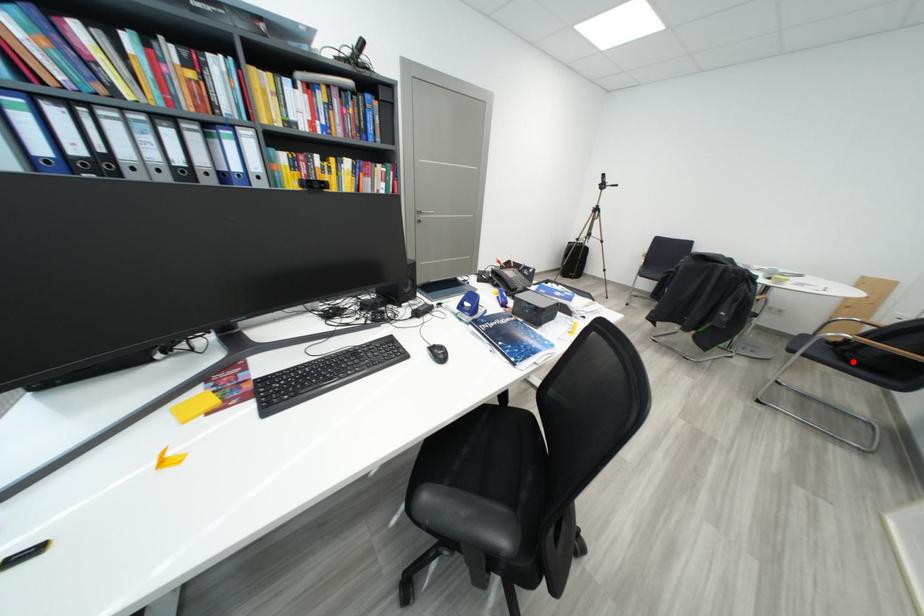
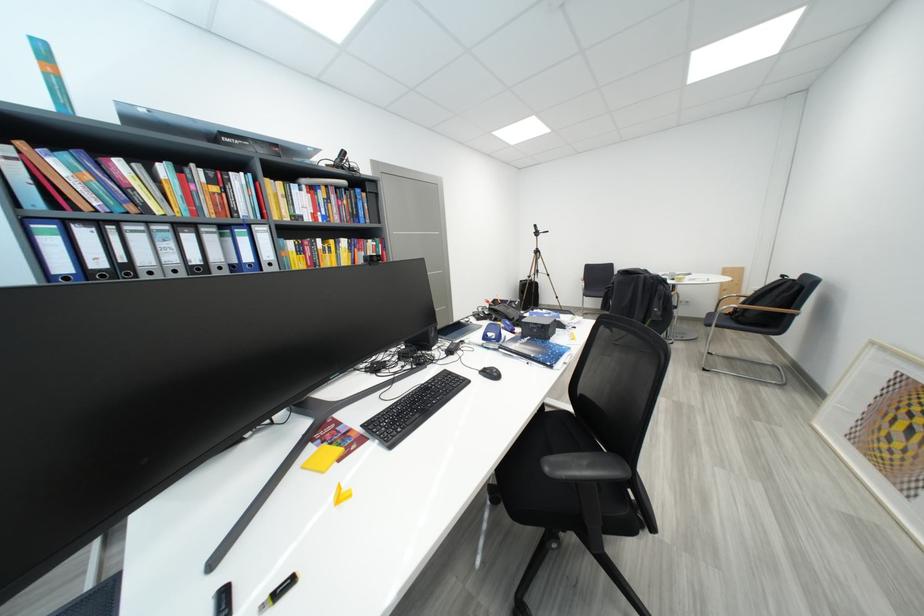
Locate, in the second image, the point that corresponds to the highlighted location in the first image.

(748, 325)